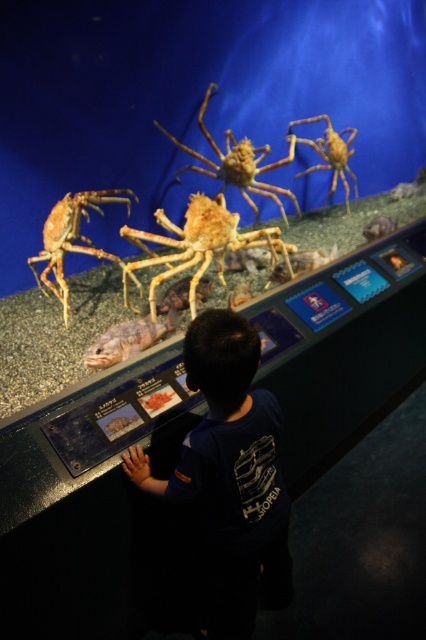
You are a tour guide at the aquarium. You need to ensure that visitors maintain a safe distance of at least 3 meters from the tank edge to prevent accidents. A visitor is standing at point (71, 243). Can they safely approach closer to the tank without violating the safety rule?

The point (71, 243) is 2.73 meters away from the camera. Since the required safe distance is 3 meters, the visitor is already within the safety zone and can move closer to the tank without violating the rule.

What is the exact position of the yellowish matte spider at center in the image?

The yellowish matte spider at center is located at point coordinates of (199, 244).

You are a parent trying to point out the two crabs to your child. Which one is on the left side between the yellowish matte spider at center and the golden textured crab at center?

The yellowish matte spider at center is located to the left of the golden textured crab at center.